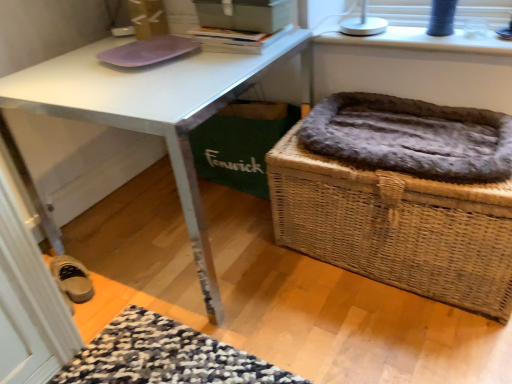
The width and height of the screenshot is (512, 384). Find the location of `free area in between white glossy desk at center and fur-lined wicker basket at right`. free area in between white glossy desk at center and fur-lined wicker basket at right is located at coordinates (326, 309).